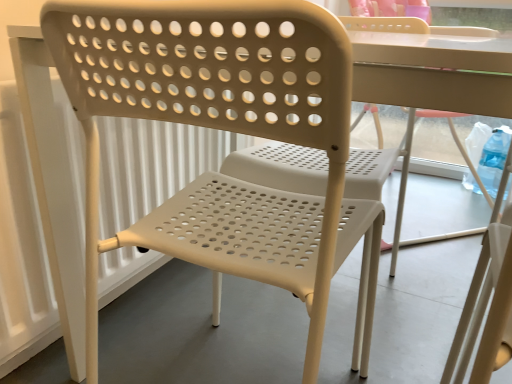
Question: Is point (374, 24) positioned closer to the camera than point (274, 36)?

Choices:
 (A) farther
 (B) closer

Answer: (A)

Question: In terms of height, does beige perforated chair at center, the 1th chair when ordered from right to left, look taller or shorter compared to beige perforated plastic chair at center, which is the first chair from front to back?

Choices:
 (A) tall
 (B) short

Answer: (A)

Question: Is beige perforated chair at center, the second chair in the front-to-back sequence, situated inside beige perforated plastic chair at center, placed as the 1th chair when sorted from left to right, or outside?

Choices:
 (A) inside
 (B) outside

Answer: (B)

Question: From their relative heights in the image, would you say beige perforated plastic chair at center, which is the first chair from front to back, is taller or shorter than beige perforated chair at center, the 1th chair when ordered from right to left?

Choices:
 (A) tall
 (B) short

Answer: (B)

Question: Considering the relative positions of beige perforated plastic chair at center, which is the first chair from front to back, and beige perforated chair at center, which ranks as the 2th chair in left-to-right order, in the image provided, is beige perforated plastic chair at center, which is the first chair from front to back, to the left or to the right of beige perforated chair at center, which ranks as the 2th chair in left-to-right order,?

Choices:
 (A) left
 (B) right

Answer: (A)

Question: Considering their positions, is beige perforated plastic chair at center, which is the 2th chair in back-to-front order, located in front of or behind beige perforated chair at center, the 1th chair when ordered from right to left?

Choices:
 (A) front
 (B) behind

Answer: (A)

Question: In terms of width, does beige perforated plastic chair at center, which is the 2th chair in back-to-front order, look wider or thinner when compared to beige perforated chair at center, placed as the first chair when sorted from back to front?

Choices:
 (A) thin
 (B) wide

Answer: (A)